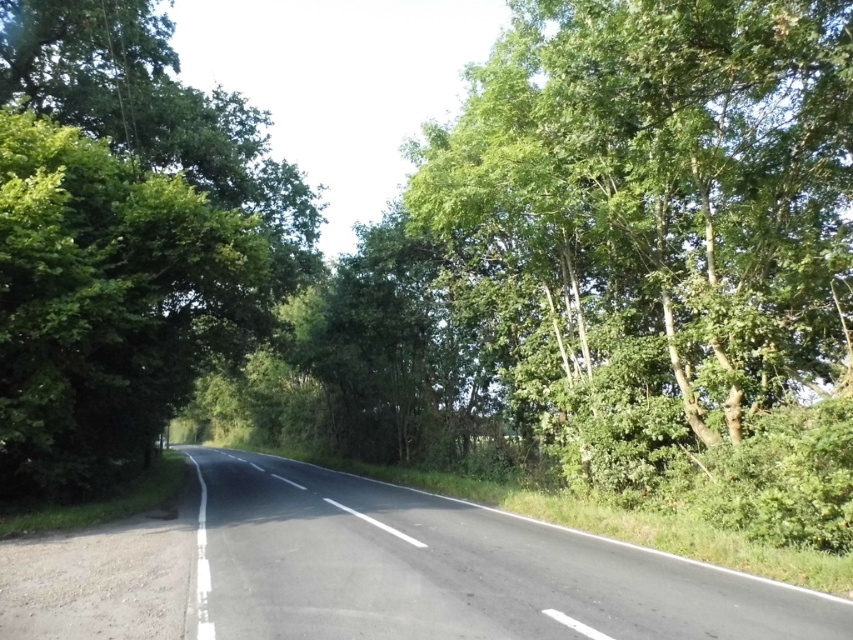
You are driving a car that is 2 meters wide. You need to park your car on the black asphalt road at center near the green leafy tree at right. Can your car fit between the tree and the edge of the road without overlapping them?

The green leafy tree at right has a lesser width compared to the black asphalt road at center. However, the width of the tree alone does not provide enough information to determine if there is sufficient space between the tree and the road edge for parking. The total available space between the tree and the road edge must be at least 2 meters. Without knowing the exact distance between them, it is impossible to confirm if the car will fit.

You are driving a car and see the two green leafy trees along the road. Which tree would appear closer to you if you look through your windshield? The green leafy tree at right or the green leafy tree at left?

The green leafy tree at right is smaller than the green leafy tree at left, so the green leafy tree at left would appear closer to you because larger objects typically appear closer when viewed from the same distance.

You are a bird flying over a two lane road. You see the green leafy tree at right and the black asphalt road at center. Which object is higher from the ground?

The green leafy tree at right is above the black asphalt road at center, so the green leafy tree at right is higher from the ground.